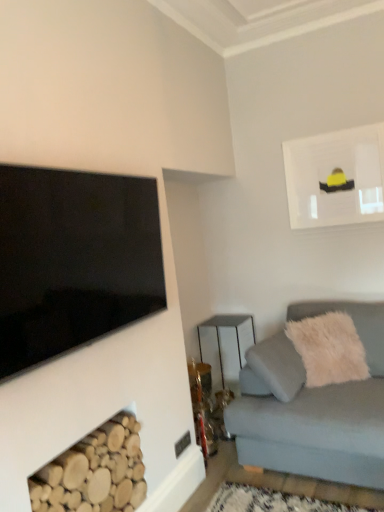
Question: From the image's perspective, relative to black glossy tv at upper left, is matte white picture frame at upper right above or below?

Choices:
 (A) above
 (B) below

Answer: (A)

Question: From a real-world perspective, is matte white picture frame at upper right above or below black glossy tv at upper left?

Choices:
 (A) below
 (B) above

Answer: (B)

Question: Which is nearer to the white fluffy pillow at right?

Choices:
 (A) light gray fabric couch at lower right
 (B) metallic silver table at center
 (C) natural wood logs at lower left
 (D) matte white picture frame at upper right
 (E) black glossy tv at upper left

Answer: (A)

Question: Which object is the closest to the light gray fabric couch at lower right?

Choices:
 (A) metallic silver table at center
 (B) natural wood logs at lower left
 (C) black glossy tv at upper left
 (D) matte white picture frame at upper right
 (E) white fluffy pillow at right

Answer: (E)